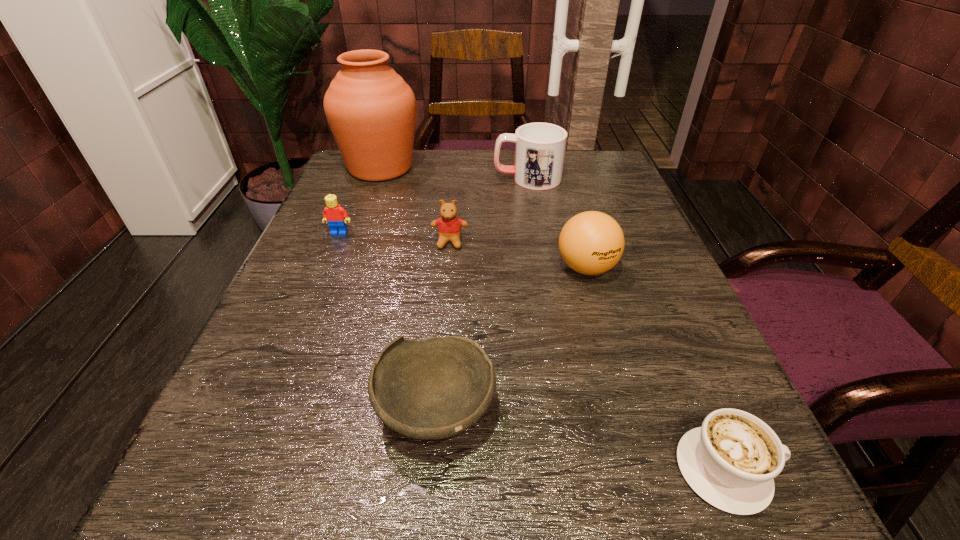
This screenshot has height=540, width=960. I want to click on free spot located 0.380m on the side of the mug with the handle, so click(x=334, y=178).

At what (x,y) coordinates should I click in order to perform the action: click on free space located on the side with brand of the ping-pong ball. Please return your answer as a coordinate pair (x, y). The width and height of the screenshot is (960, 540). Looking at the image, I should click on point(637,449).

Find the location of a particular element. The width and height of the screenshot is (960, 540). free space located on the face of the Lego is located at coordinates (263, 417).

Where is `vacant space located 0.350m on the front-facing side of the teddy bear`? This screenshot has width=960, height=540. vacant space located 0.350m on the front-facing side of the teddy bear is located at coordinates (435, 415).

In order to click on vacant space located on the right of the bowl in this screenshot , I will do `click(548, 410)`.

Locate an element on the screen. This screenshot has width=960, height=540. urn that is at the far edge is located at coordinates (371, 111).

Locate an element on the screen. mug situated at the far edge is located at coordinates (540, 148).

Locate an element on the screen. object situated at the near edge is located at coordinates (731, 461).

I want to click on urn located at the left edge, so click(371, 111).

At what (x,y) coordinates should I click in order to perform the action: click on Lego present at the left edge. Please return your answer as a coordinate pair (x, y). Looking at the image, I should click on (336, 216).